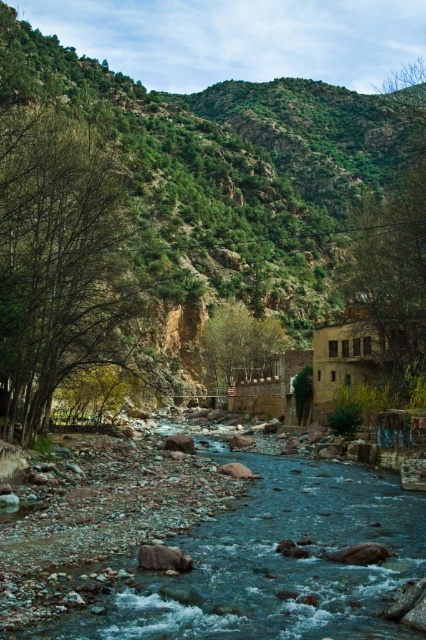
Which is more to the right, green leafy tree at left or green leafy tree at center?

Positioned to the right is green leafy tree at center.

Is point (80, 125) less distant than point (227, 342)?

No, (80, 125) is further to viewer.

Identify the location of green leafy tree at left. (66, 262).

Is green rocky mountain at center to the left of green leafy tree at center from the viewer's perspective?

Incorrect, green rocky mountain at center is not on the left side of green leafy tree at center.

Does green rocky mountain at center have a greater height compared to green leafy tree at center?

Correct, green rocky mountain at center is much taller as green leafy tree at center.

Identify the location of green rocky mountain at center. (189, 211).

Is smooth rock stream at center wider than green leafy tree at center?

Yes, smooth rock stream at center is wider than green leafy tree at center.

The width and height of the screenshot is (426, 640). What do you see at coordinates (273, 563) in the screenshot?
I see `smooth rock stream at center` at bounding box center [273, 563].

You are a GUI agent. You are given a task and a screenshot of the screen. Output one action in this format:
    pyautogui.click(x=<x>, y=<y>)
    Task: Click on the smooth rock stream at center
    Image resolution: width=426 pixels, height=640 pixels.
    Given the screenshot: What is the action you would take?
    pyautogui.click(x=273, y=563)